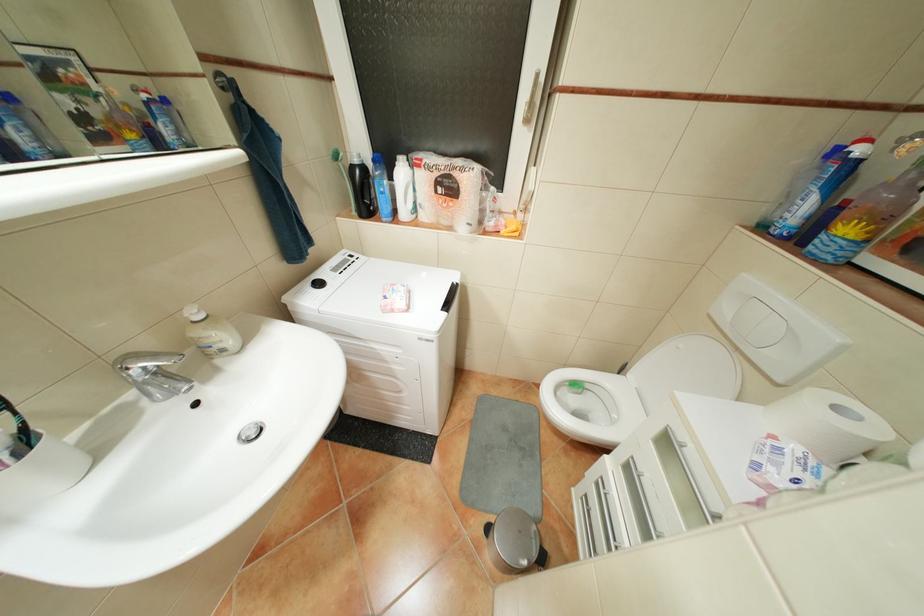
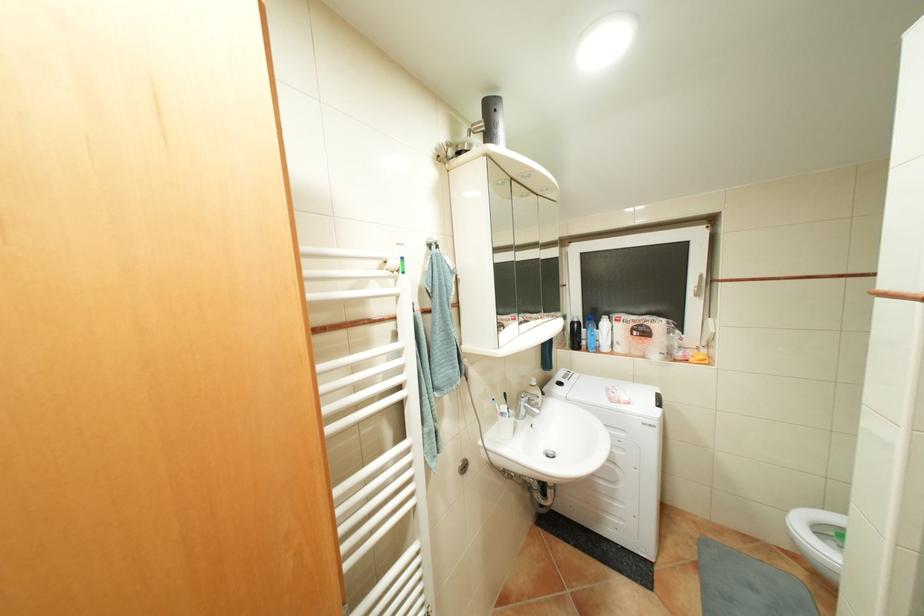
The point at (536, 120) is marked in the first image. Where is the corresponding point in the second image?

(707, 294)